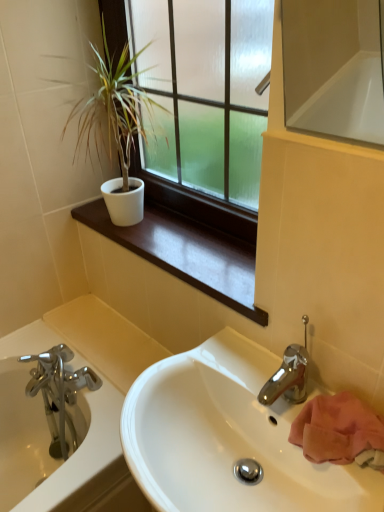
This screenshot has width=384, height=512. What are the coordinates of `vacant space in matte glass window at upper center (from a real-world perspective)` in the screenshot? It's located at (210, 238).